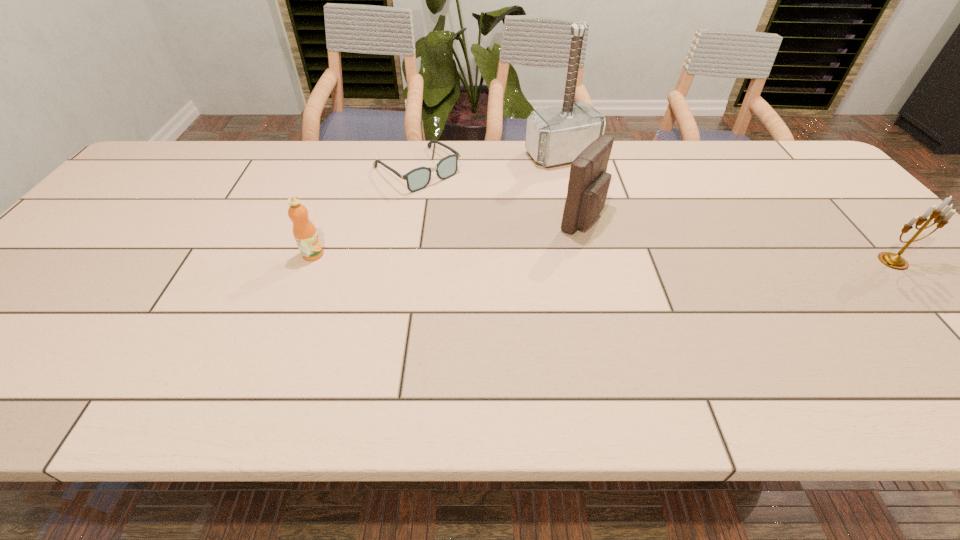
Identify the location of free space located 0.170m with an open flap on the third nearest object. This screenshot has width=960, height=540. (666, 254).

The image size is (960, 540). I want to click on free point located 0.400m with an open flap on the third nearest object, so click(x=766, y=294).

What are the coordinates of `vacant region located 0.130m for striking with the head of the hammer` in the screenshot? It's located at 599,194.

Locate an element on the screen. The width and height of the screenshot is (960, 540). vacant space situated 0.310m for striking with the head of the hammer is located at coordinates (633, 232).

You are a GUI agent. You are given a task and a screenshot of the screen. Output one action in this format:
    pyautogui.click(x=<x>, y=<y>)
    Task: Click on the vacant space situated 0.090m for striking with the head of the hammer
    
    Given the screenshot: What is the action you would take?
    pyautogui.click(x=591, y=186)

I want to click on vacant area situated on the face of the shortest object, so click(453, 200).

Locate an element on the screen. The image size is (960, 540). free region located on the face of the shortest object is located at coordinates [x=485, y=227].

The image size is (960, 540). What are the coordinates of `vacant space located 0.270m on the face of the shortest object` in the screenshot? It's located at (499, 239).

Image resolution: width=960 pixels, height=540 pixels. I want to click on hammer that is at the far edge, so click(556, 135).

At what (x,y) coordinates should I click in order to perform the action: click on spectacles located at the far edge. Please return your answer as a coordinate pair (x, y). This screenshot has height=540, width=960. Looking at the image, I should click on (418, 178).